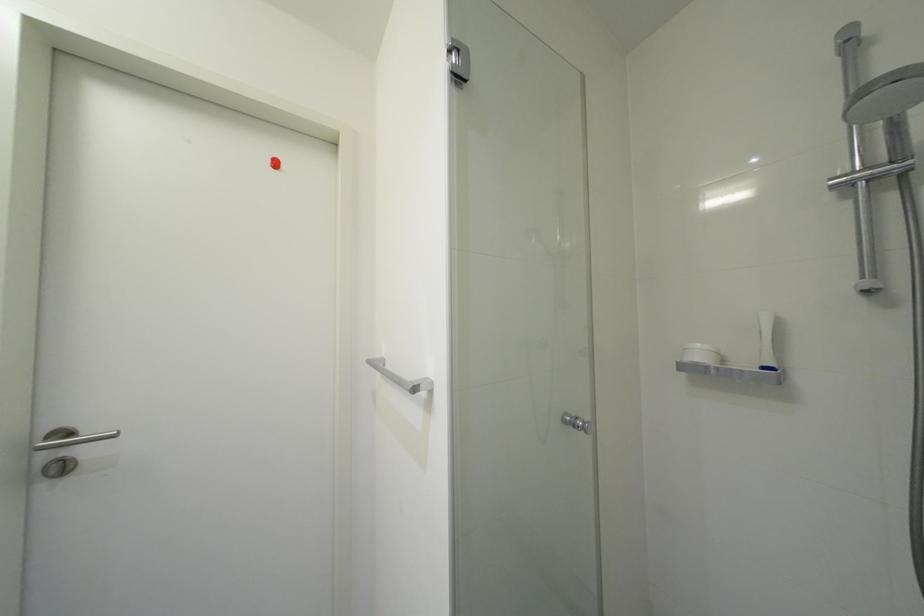
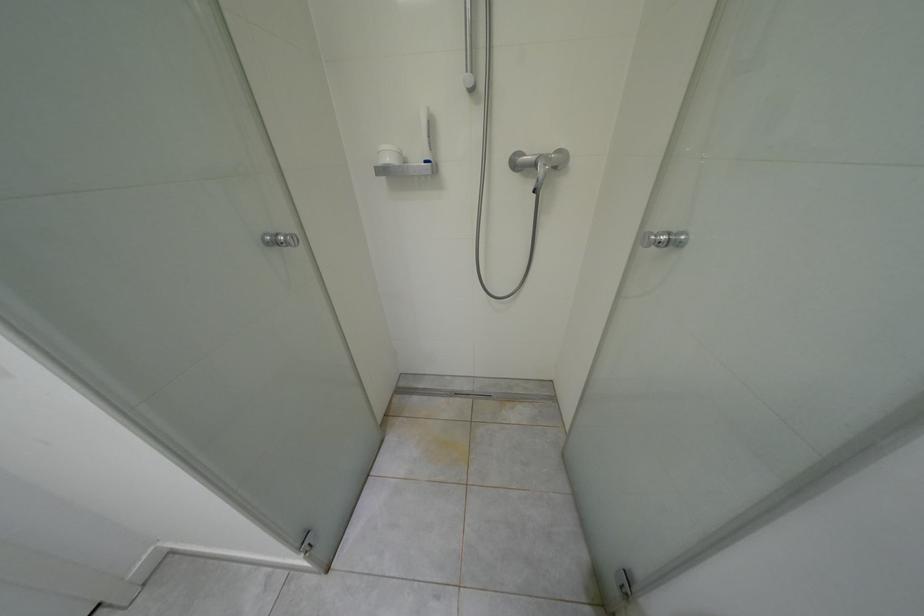
Based on the continuous images, in which direction is the camera rotating?

The camera rotated toward right-down.